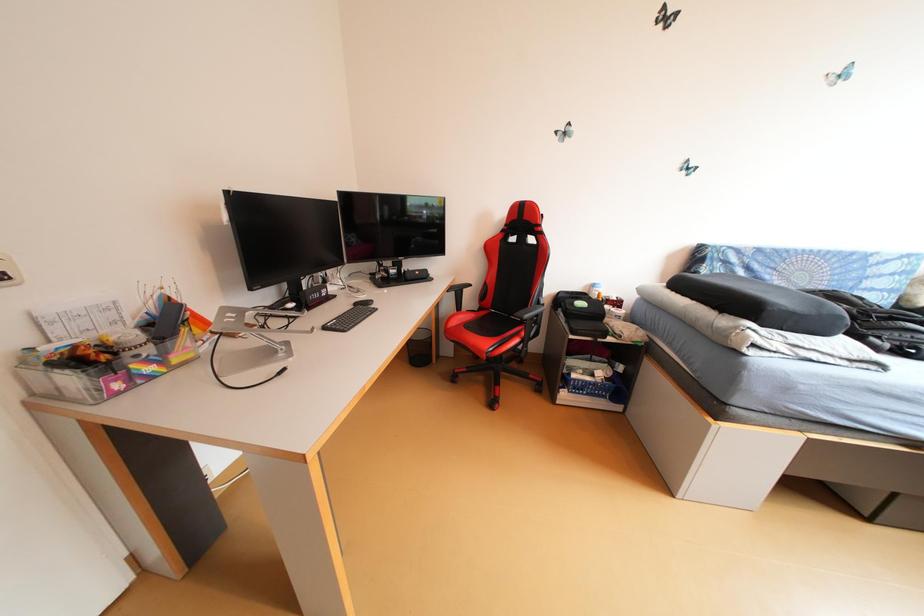
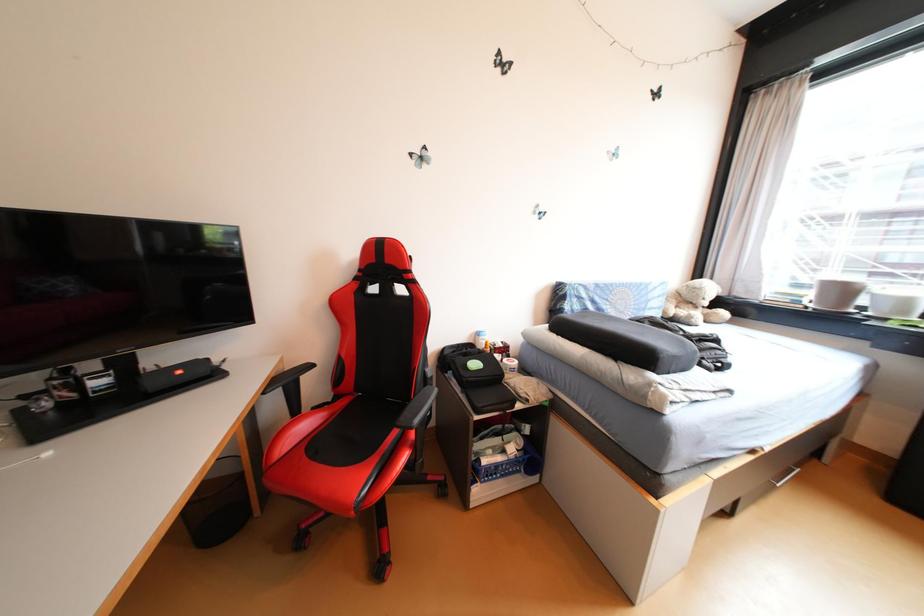
Question: The camera is either moving clockwise (left) or counter-clockwise (right) around the object. The first image is from the beginning of the video and the second image is from the end. Is the camera moving left or right when shooting the video?

Choices:
 (A) Left
 (B) Right

Answer: (A)